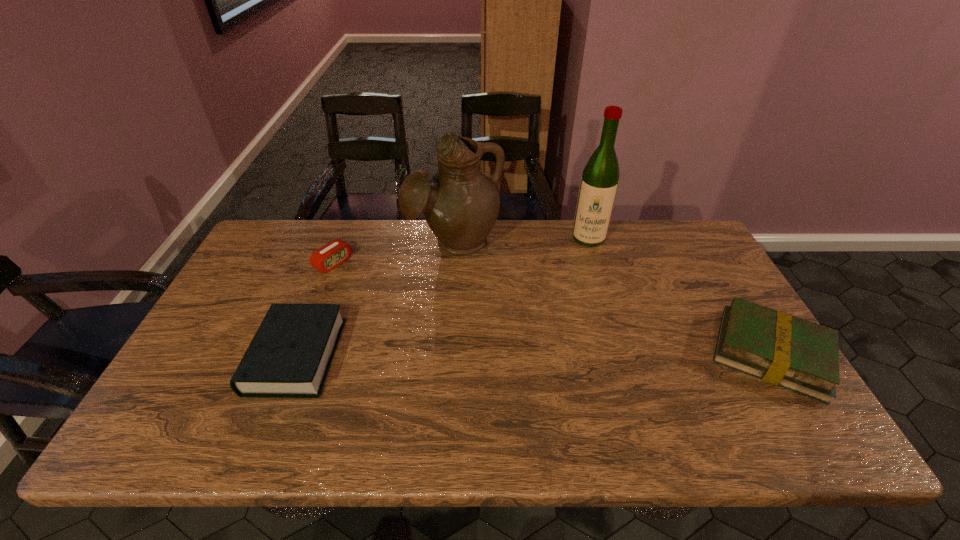
Locate an element on the screen. The image size is (960, 540). unoccupied area between the third object from left to right and the book is located at coordinates (612, 298).

Image resolution: width=960 pixels, height=540 pixels. In order to click on vacant space that's between the pitcher and the book in this screenshot , I will do `click(612, 298)`.

Locate an element on the screen. The height and width of the screenshot is (540, 960). vacant space that's between the Bible and the rightmost object is located at coordinates (534, 355).

Find the location of a particular element. Image resolution: width=960 pixels, height=540 pixels. unoccupied area between the Bible and the book is located at coordinates (534, 355).

The height and width of the screenshot is (540, 960). I want to click on vacant space that is in between the Bible and the liquor, so click(443, 297).

What are the coordinates of `unoccupied position between the second object from right to left and the book` in the screenshot? It's located at (680, 296).

Select which object is the second closest to the rightmost object. Please provide its 2D coordinates. Your answer should be formatted as a tuple, i.e. [(x, y)], where the tuple contains the x and y coordinates of a point satisfying the conditions above.

[(460, 204)]

The height and width of the screenshot is (540, 960). I want to click on object that is the fourth closest to the book, so click(x=331, y=255).

Locate an element on the screen. This screenshot has height=540, width=960. free space that satisfies the following two spatial constraints: 1. on the back side of the pitcher; 2. on the right side of the Bible is located at coordinates (341, 242).

Where is `free space that satisfies the following two spatial constraints: 1. on the back side of the Bible; 2. on the right side of the alarm clock`? The image size is (960, 540). free space that satisfies the following two spatial constraints: 1. on the back side of the Bible; 2. on the right side of the alarm clock is located at coordinates (332, 263).